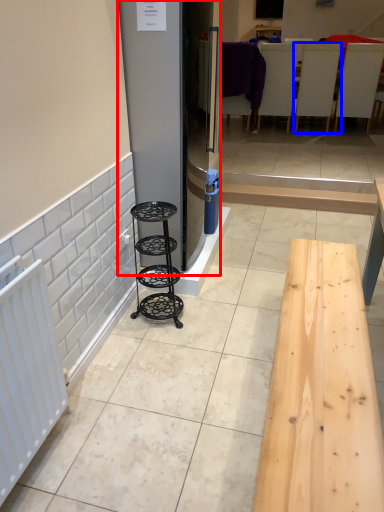
Question: Which object appears farthest to the camera in this image, fridge (highlighted by a red box) or furniture (highlighted by a blue box)?

Choices:
 (A) fridge
 (B) furniture

Answer: (B)